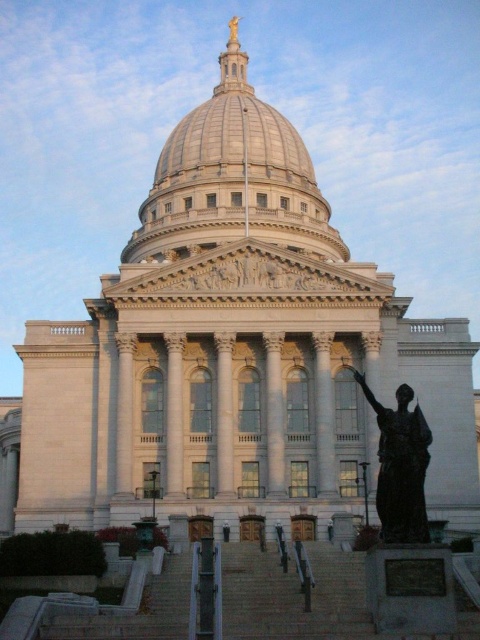
Can you confirm if shiny metallic dome at center is taller than gray concrete stairs at center?

Yes.

Which is in front, point (272, 208) or point (356, 614)?

Point (356, 614) is more forward.

Between point (278, 173) and point (158, 579), which one is positioned behind?

The point (278, 173) is behind.

The image size is (480, 640). In order to click on shiny metallic dome at center in this screenshot , I will do `click(232, 179)`.

Between point (48, 632) and point (405, 476), which one is positioned behind?

The point (405, 476) is behind.

Is point (254, 568) positioned behind point (376, 490)?

No, it is in front of (376, 490).

In order to click on gray concrete stairs at center in this screenshot , I will do `click(294, 595)`.

Does point (284, 156) come farther from viewer compared to point (427, 442)?

That is True.

Between shiny metallic dome at center and bronze statue at right, which one appears on the left side from the viewer's perspective?

Positioned to the left is shiny metallic dome at center.

Does point (227, 106) come closer to viewer compared to point (400, 488)?

No, it is not.

Identify the location of shiny metallic dome at center. This screenshot has width=480, height=640. (232, 179).